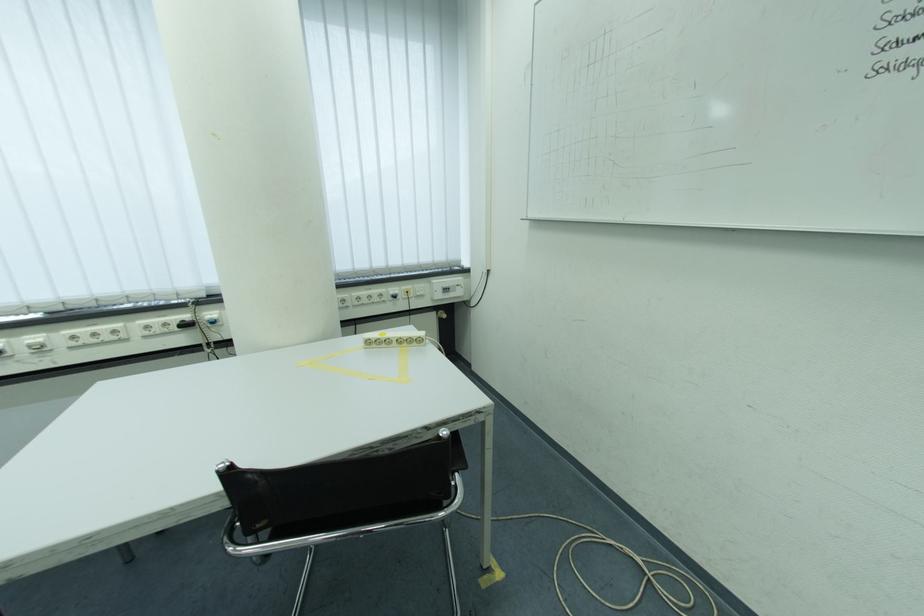
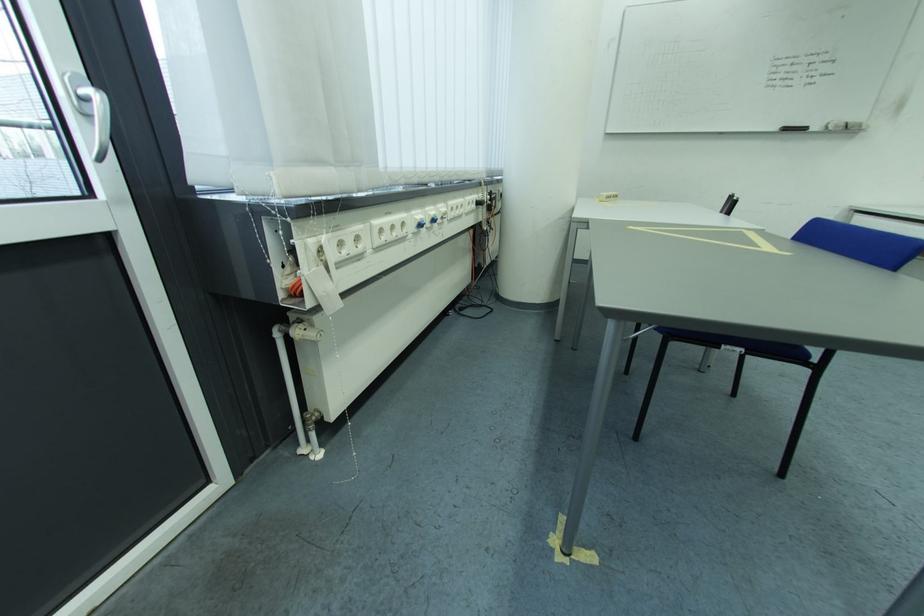
Where in the second image is the point corresponding to the point at 50,342 from the first image?

(454, 212)